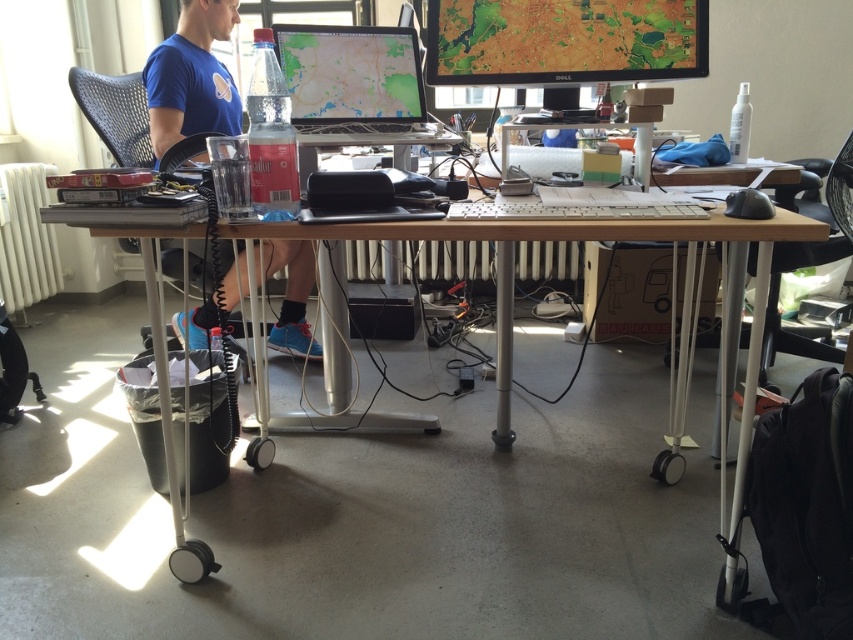
You are a delivery person who needs to place a small package between the matte plastic monitor at upper center and the black plastic chair at right. The package measures 12 inches in length. Can you fit the package horizontally between them without moving either object?

The distance between the matte plastic monitor at upper center and the black plastic chair at right is 37.57 inches. Since the package is only 12 inches long, it can easily be placed horizontally between them without needing to move either object.

You are organizing a desk and need to place a new item between the wooden desk at center and the matte plastic monitor at upper center. Which object should you place it closer to?

The wooden desk at center is below the matte plastic monitor at upper center, so placing the new item closer to the desk would mean positioning it between the desk and the monitor, closer to the desk.

Please provide the 2D coordinates of the wooden desk at center in the image.

The wooden desk at center is located at coordinates point [511,305].